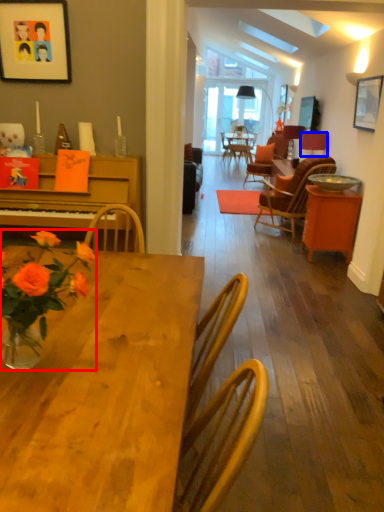
Question: Which of the following is the closest to the observer, flower (highlighted by a red box) or lamp (highlighted by a blue box)?

Choices:
 (A) flower
 (B) lamp

Answer: (A)